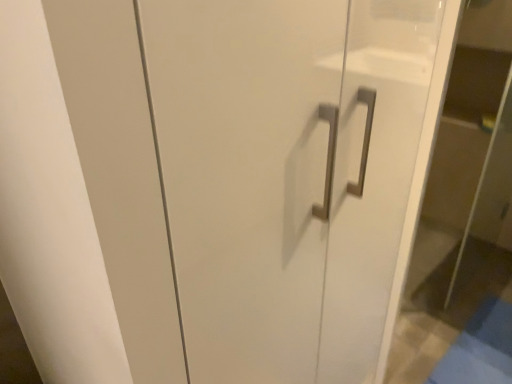
What do you see at coordinates (246, 175) in the screenshot?
I see `satin silver handle at center` at bounding box center [246, 175].

Identify the location of satin silver handle at center. (246, 175).

Where is `satin silver handle at center`? This screenshot has height=384, width=512. satin silver handle at center is located at coordinates (246, 175).